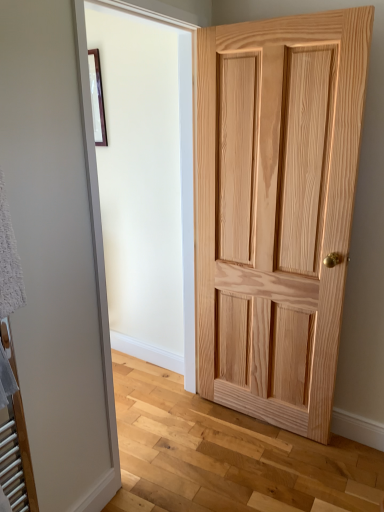
Question: In terms of height, does natural wood door at right look taller or shorter compared to matte black picture frame at upper left?

Choices:
 (A) short
 (B) tall

Answer: (B)

Question: From a real-world perspective, is natural wood door at right above or below matte black picture frame at upper left?

Choices:
 (A) above
 (B) below

Answer: (B)

Question: Visually, is natural wood door at right positioned to the left or to the right of matte black picture frame at upper left?

Choices:
 (A) right
 (B) left

Answer: (A)

Question: Looking at their shapes, would you say matte black picture frame at upper left is wider or thinner than natural wood door at right?

Choices:
 (A) wide
 (B) thin

Answer: (B)

Question: From the image's perspective, is matte black picture frame at upper left above or below natural wood door at right?

Choices:
 (A) below
 (B) above

Answer: (B)

Question: In the image, is matte black picture frame at upper left on the left side or the right side of natural wood door at right?

Choices:
 (A) right
 (B) left

Answer: (B)

Question: In terms of height, does matte black picture frame at upper left look taller or shorter compared to natural wood door at right?

Choices:
 (A) short
 (B) tall

Answer: (A)